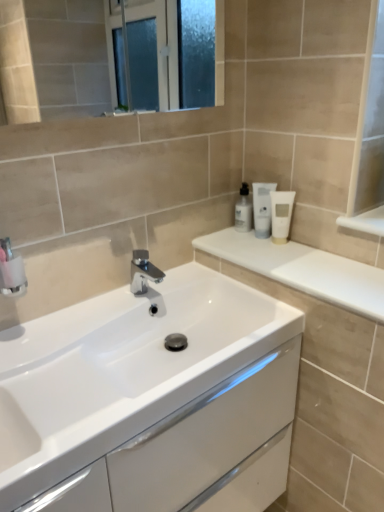
The width and height of the screenshot is (384, 512). In order to click on free space in front of chrome metallic faucet at center in this screenshot , I will do `click(112, 319)`.